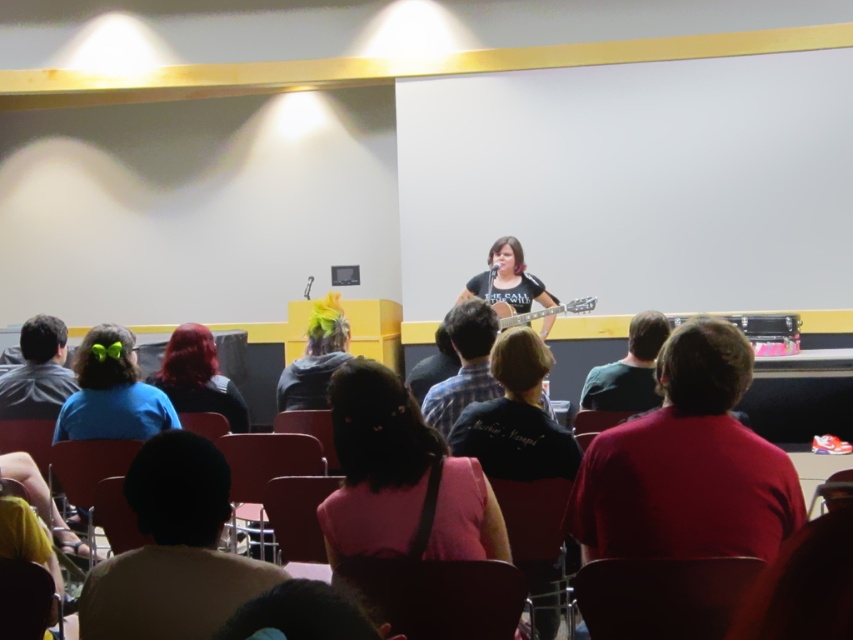
You are a photographer standing behind the audience. You want to take a photo of both the blue matte shirt at lower left and the green matte shirt at center so that both are clearly visible in the frame. Given that your camera has a minimum focus distance of 5 feet, will you be able to capture both shirts in focus without moving closer?

The blue matte shirt at lower left is 6.36 feet from the green matte shirt at center. Since the distance between them is greater than the camera minimum focus distance of 5 feet, the camera can capture both shirts in focus as long as they are within the depth of field. However, the exact focus depends on the camera settings and lens used.

You are sitting in the front row of the auditorium and notice two people in the audience wearing blue matte shirt at lower left and green matte shirt at center. Which person is sitting closer to the stage?

The blue matte shirt at lower left is positioned under the green matte shirt at center, meaning it is closer to the stage.